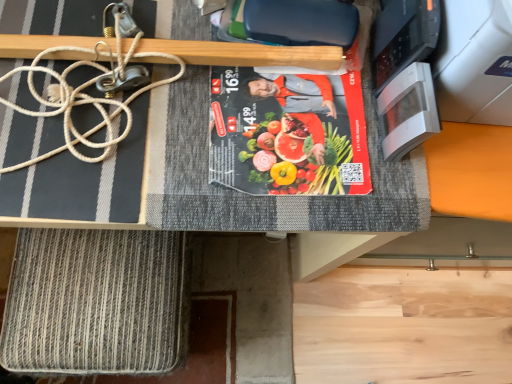
Question: Visually, is white glossy microwave at upper right positioned to the left or to the right of matte black book at center?

Choices:
 (A) right
 (B) left

Answer: (A)

Question: Is white glossy microwave at upper right inside the boundaries of matte black book at center, or outside?

Choices:
 (A) outside
 (B) inside

Answer: (A)

Question: Estimate the real-world distances between objects in this image. Which object is closer to the rope-like textured mat at lower left?

Choices:
 (A) white rope at upper left
 (B) white glossy microwave at upper right
 (C) wooden at upper center
 (D) matte black book at center

Answer: (A)

Question: Which object is the farthest from the rope-like textured mat at lower left?

Choices:
 (A) white glossy microwave at upper right
 (B) wooden at upper center
 (C) matte black book at center
 (D) white rope at upper left

Answer: (A)